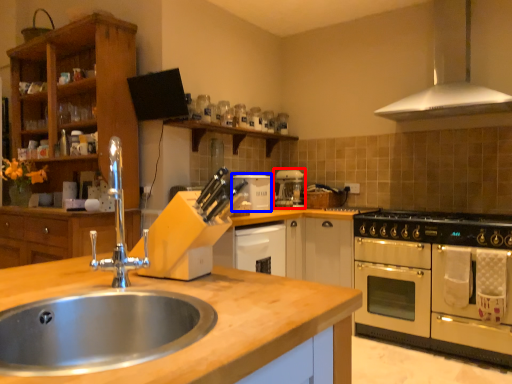
Question: Which object is closer to the camera taking this photo, coffee machine (highlighted by a red box) or appliance (highlighted by a blue box)?

Choices:
 (A) coffee machine
 (B) appliance

Answer: (B)